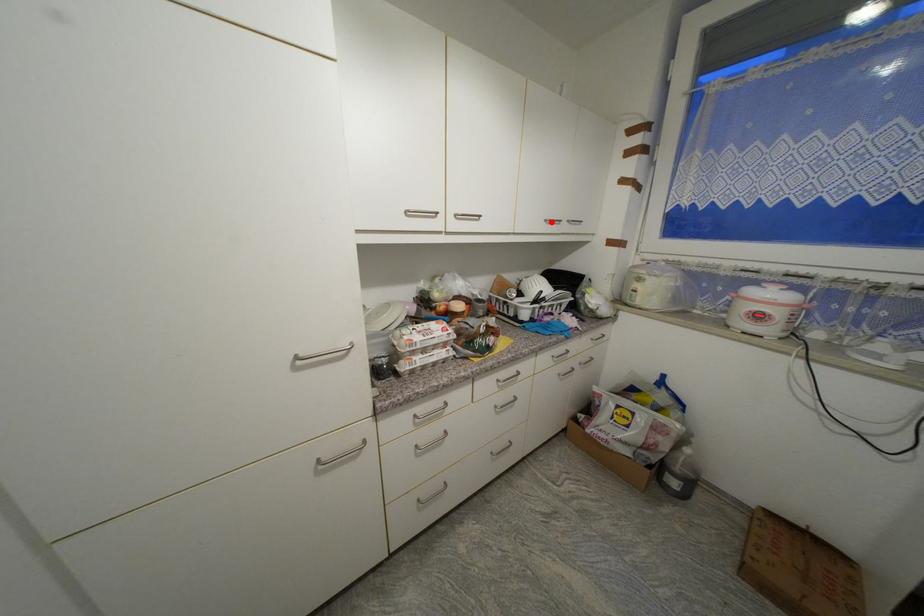
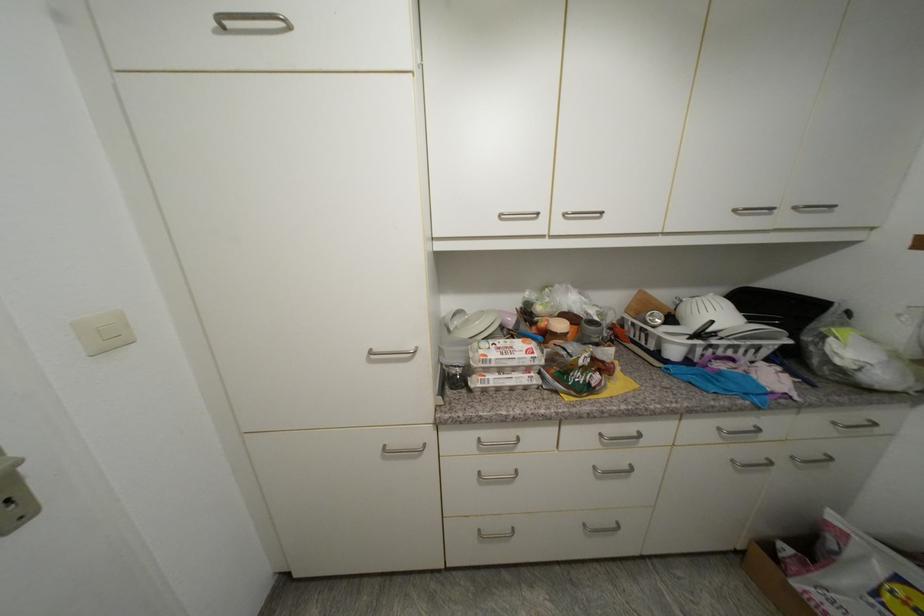
Where in the second image is the point corresponding to the highlighted location from the first image?

(740, 213)